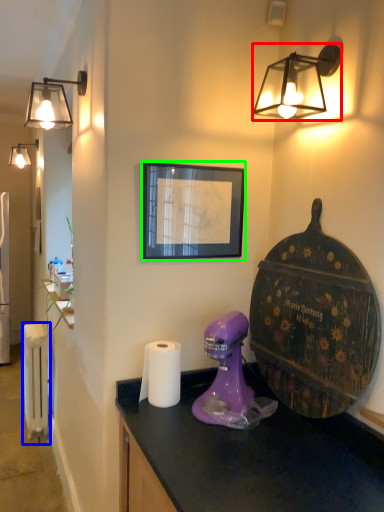
Question: Which object is the closest to the lamp (highlighted by a red box)? Choose among these: radiator (highlighted by a blue box) or picture frame (highlighted by a green box).

Choices:
 (A) radiator
 (B) picture frame

Answer: (B)